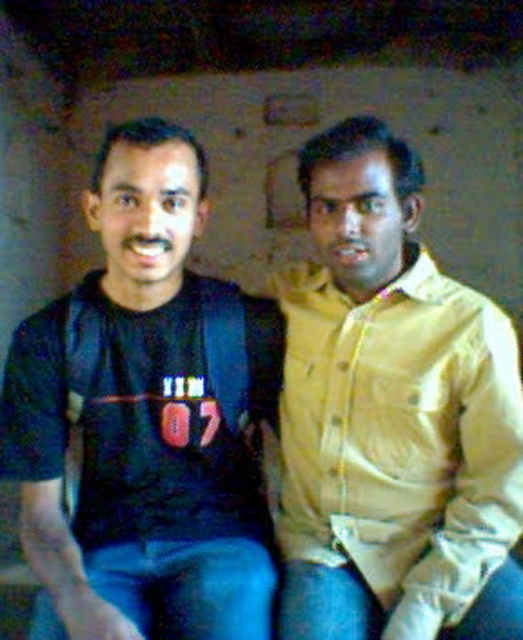
Question: Which of the following is the closest to the observer?

Choices:
 (A) (243, 330)
 (B) (453, 460)

Answer: (B)

Question: Which point appears closest to the camera in this image?

Choices:
 (A) (22, 458)
 (B) (426, 317)

Answer: (B)

Question: Which point is farther to the camera?

Choices:
 (A) click(513, 424)
 (B) click(160, 312)

Answer: (B)

Question: Can you confirm if black matte t-shirt at left is positioned above yellow cotton shirt at right?

Choices:
 (A) no
 (B) yes

Answer: (B)

Question: Does black matte t-shirt at left appear under yellow cotton shirt at right?

Choices:
 (A) no
 (B) yes

Answer: (A)

Question: Considering the relative positions of black matte t-shirt at left and yellow cotton shirt at right in the image provided, where is black matte t-shirt at left located with respect to yellow cotton shirt at right?

Choices:
 (A) left
 (B) right

Answer: (A)